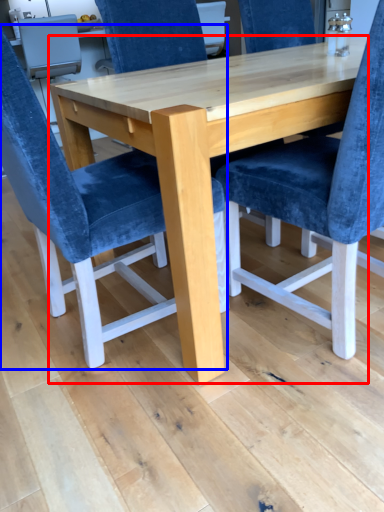
Question: Which object is closer to the camera taking this photo, table (highlighted by a red box) or chair (highlighted by a blue box)?

Choices:
 (A) table
 (B) chair

Answer: (B)